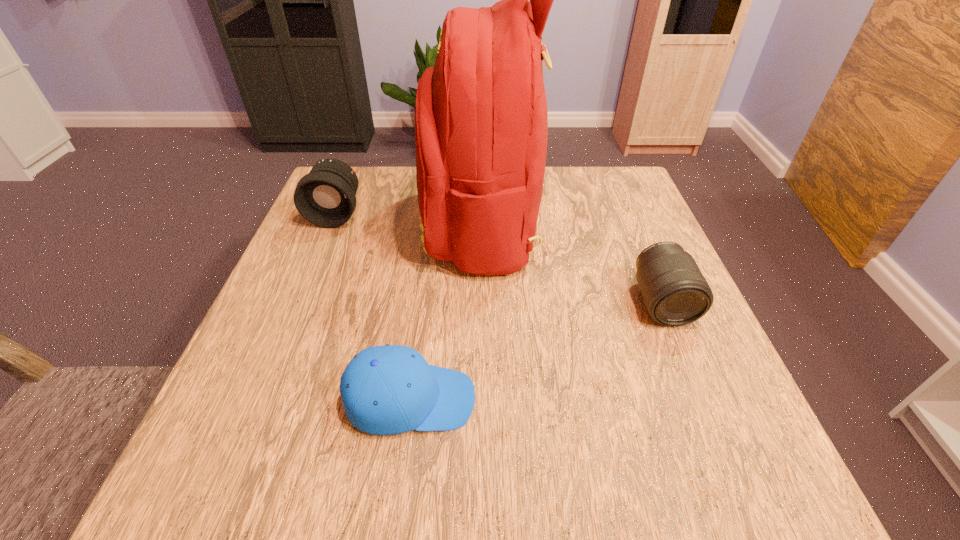
I want to click on free spot between the cap and the backpack, so click(446, 312).

Image resolution: width=960 pixels, height=540 pixels. Identify the location of free area in between the nearer telephoto lens and the tallest object. (572, 263).

Identify the location of object that stands as the closest to the right telephoto lens. (481, 121).

Identify which object is the second closest to the backpack. Please provide its 2D coordinates. Your answer should be formatted as a tuple, i.e. [(x, y)], where the tuple contains the x and y coordinates of a point satisfying the conditions above.

[(675, 293)]

I want to click on free point that satisfies the following two spatial constraints: 1. on the surface of the right telephoto lens; 2. on the front-facing side of the cap, so click(x=702, y=399).

You are a GUI agent. You are given a task and a screenshot of the screen. Output one action in this format:
    pyautogui.click(x=<x>, y=<y>)
    Task: Click on the free spot that satisfies the following two spatial constraints: 1. on the surface of the nearer telephoto lens; 2. on the front-facing side of the cap
    The image size is (960, 540).
    Given the screenshot: What is the action you would take?
    pyautogui.click(x=702, y=399)